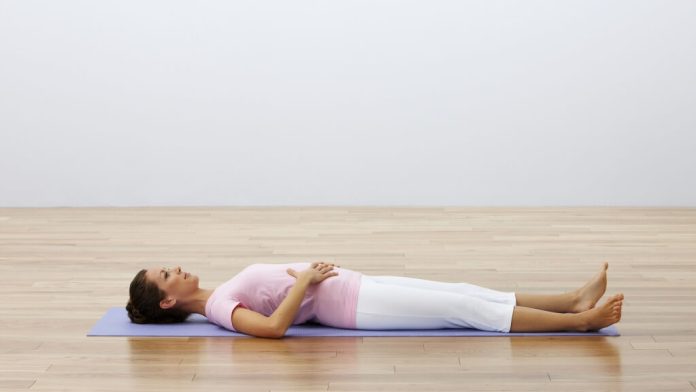
Locate an element on the screen. This screenshot has height=392, width=696. purple yoga mat is located at coordinates (106, 328).